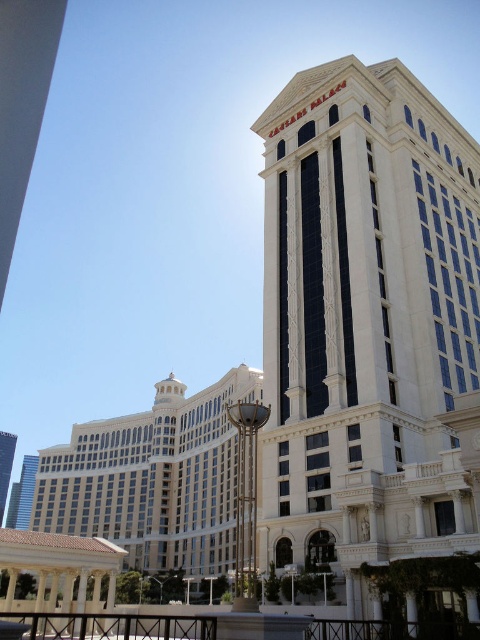
Does white marble building at center appear on the right side of white marble tower at center?

Correct, you'll find white marble building at center to the right of white marble tower at center.

Can you confirm if white marble building at center is positioned to the left of white marble tower at center?

Incorrect, white marble building at center is not on the left side of white marble tower at center.

Between point (361, 221) and point (4, 448), which one is positioned behind?

The point (4, 448) is more distant.

At what (x,y) coordinates should I click in order to perform the action: click on white marble building at center. Please return your answer as a coordinate pair (x, y). The image size is (480, 640). Looking at the image, I should click on (365, 323).

Does beige stone building at lower left appear under white marble tower at center?

Incorrect, beige stone building at lower left is not positioned below white marble tower at center.

Who is more forward, (37, 515) or (1, 435)?

Point (37, 515)

Does point (207, 544) come closer to viewer compared to point (13, 442)?

Yes, it is.

At what (x,y) coordinates should I click in order to perform the action: click on beige stone building at lower left. Please return your answer as a coordinate pair (x, y). This screenshot has width=480, height=640. Looking at the image, I should click on (153, 477).

Does white marble building at center have a larger size compared to beige stone building at lower left?

Incorrect, white marble building at center is not larger than beige stone building at lower left.

From the picture: Does white marble building at center appear under beige stone building at lower left?

No, white marble building at center is not below beige stone building at lower left.

Is point (373, 145) positioned before point (75, 492)?

Yes, it is in front of point (75, 492).

Find the location of a particular element. This screenshot has width=480, height=640. white marble building at center is located at coordinates (365, 323).